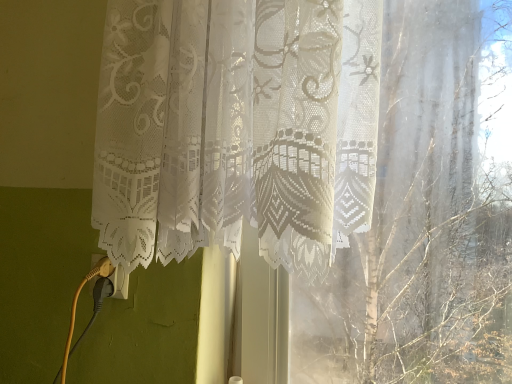
What is the approximate width of black plastic plug at lower left?

black plastic plug at lower left is 0.74 inches wide.

The height and width of the screenshot is (384, 512). Describe the element at coordinates (119, 283) in the screenshot. I see `black plastic plug at lower left` at that location.

The image size is (512, 384). In order to click on black plastic plug at lower left in this screenshot , I will do `click(119, 283)`.

What are the coordinates of `black plastic plug at lower left` in the screenshot? It's located at (119, 283).